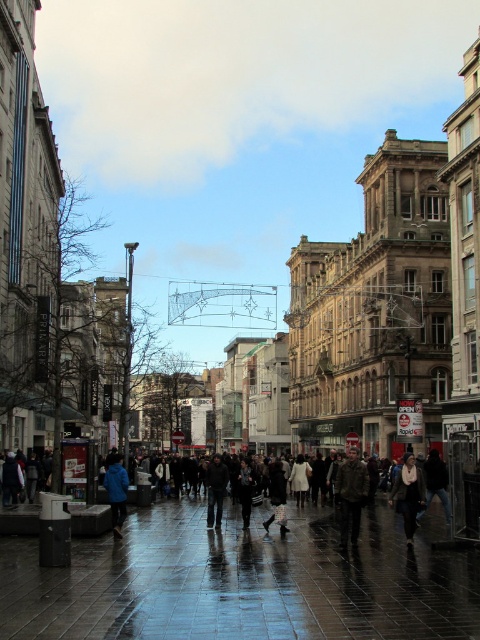
Question: Which point is closer to the camera?

Choices:
 (A) dark gray pants at center
 (B) dark gray fabric coat at center
 (C) black leather coat at center
 (D) dark gray jacket at center

Answer: (D)

Question: Which point appears farthest from the camera in this image?

Choices:
 (A) (403, 481)
 (B) (213, 516)
 (C) (435, 451)

Answer: (C)

Question: Can you confirm if black leather coat at center is wider than dark gray fabric coat at center?

Choices:
 (A) yes
 (B) no

Answer: (A)

Question: Based on their relative distances, which object is farther from the dark blue jacket at center?

Choices:
 (A) blue fabric jacket at center
 (B) black leather coat at center
 (C) glossy tile pavement at center
 (D) dark gray fabric coat at center

Answer: (C)

Question: Does dark gray jacket at center have a lesser width compared to dark gray fabric coat at center?

Choices:
 (A) no
 (B) yes

Answer: (A)

Question: Can you confirm if brown leather jacket at center is smaller than white scarf at center?

Choices:
 (A) yes
 (B) no

Answer: (B)